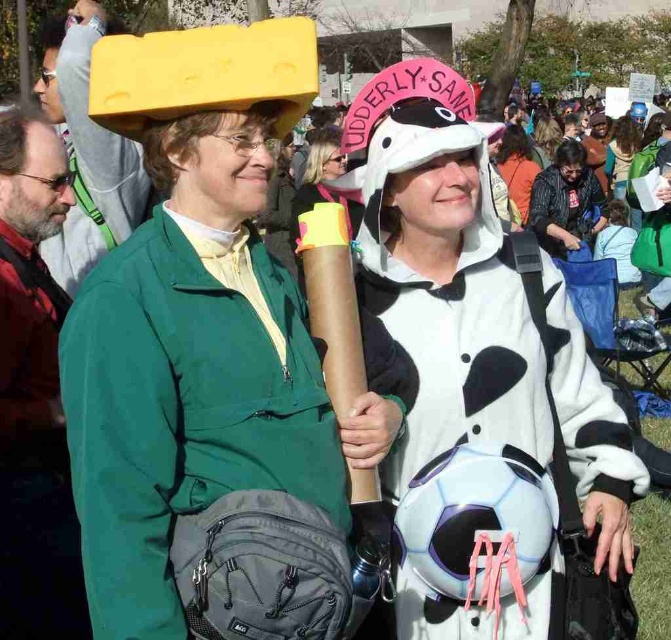
Does white plush hat at center lie in front of matte black backpack at center?

Yes, white plush hat at center is closer to the viewer.

Which is behind, point (354, 228) or point (609, 173)?

Point (609, 173)

Measure the distance between white plush hat at center and camera.

white plush hat at center is 7.52 meters from camera.

Find the location of a particular element. white plush hat at center is located at coordinates (323, 179).

Is white fuzzy onesie at center taller than white fleece onesie at center?

No, white fuzzy onesie at center is not taller than white fleece onesie at center.

Which is behind, point (572, 326) or point (515, 145)?

The point (515, 145) is more distant.

Is point (366, 228) farther from camera compared to point (523, 211)?

That is False.

The height and width of the screenshot is (640, 671). Find the location of `white fuzzy onesie at center`. white fuzzy onesie at center is located at coordinates (488, 404).

Is matte black jacket at left to the right of white fleece onesie at center from the viewer's perspective?

No, matte black jacket at left is not to the right of white fleece onesie at center.

The image size is (671, 640). In order to click on matte black jacket at left in this screenshot , I will do `click(34, 392)`.